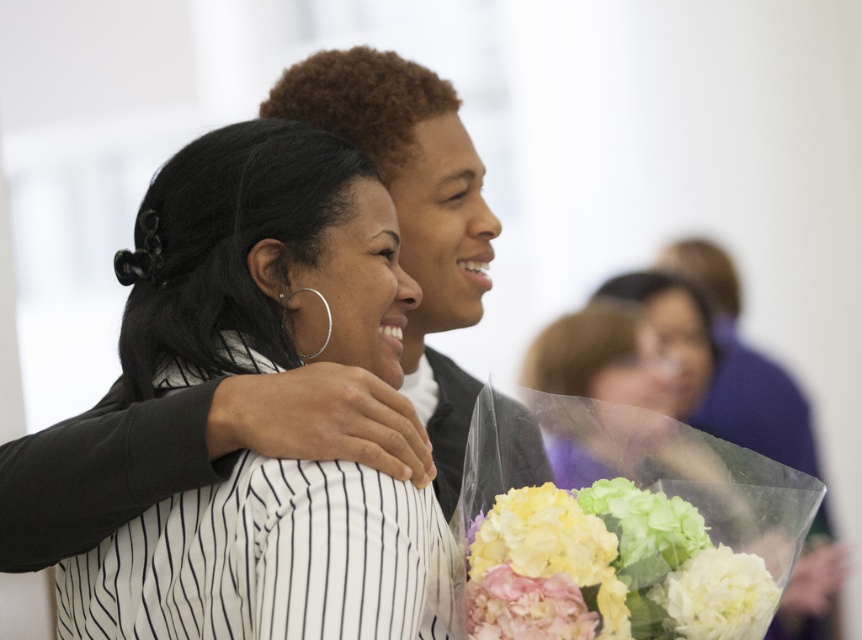
You are a photographer adjusting your camera settings to focus on the black matte hair at center and the white matte bouquet at lower right. Based on their sizes in the image, which object should you prioritize focusing on first if you want to ensure the larger one is sharp?

The black matte hair at center is much taller as white matte bouquet at lower right, so you should prioritize focusing on the black matte hair at center first since it is larger.

From the picture: You are a photographer standing at a certain distance from the subjects. You notice the white matte bouquet at lower right in your viewfinder. If you want to get a closer shot of the bouquet while keeping the subjects in focus, what adjustment should you make?

To get a closer shot of the white matte bouquet at lower right while keeping the subjects in focus, you should move closer to the bouquet. The bouquet is currently 4.02 feet away from the camera, so moving closer will allow you to zoom in without losing focus on the subjects.

You are a photographer adjusting the focus on your camera. You want to ensure that both the white matte bouquet at lower right and the pink silk flower at lower center are in sharp focus. Given their positions, which one should you focus on to achieve this?

To ensure both the white matte bouquet at lower right and the pink silk flower at lower center are in focus, focus on the pink silk flower at lower center since it is closer to the camera than the white matte bouquet at lower right.